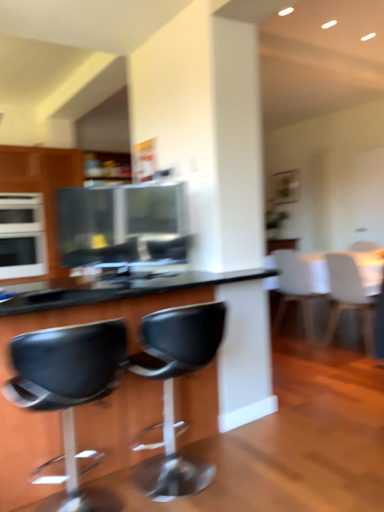
Locate an element on the screen. The height and width of the screenshot is (512, 384). vacant space to the right of black plastic table at center, the second table positioned from the right is located at coordinates (314, 432).